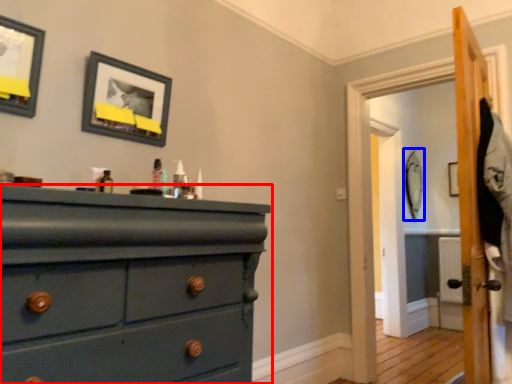
Question: Which of the following is the closest to the observer, chest of drawers (highlighted by a red box) or picture frame (highlighted by a blue box)?

Choices:
 (A) chest of drawers
 (B) picture frame

Answer: (A)